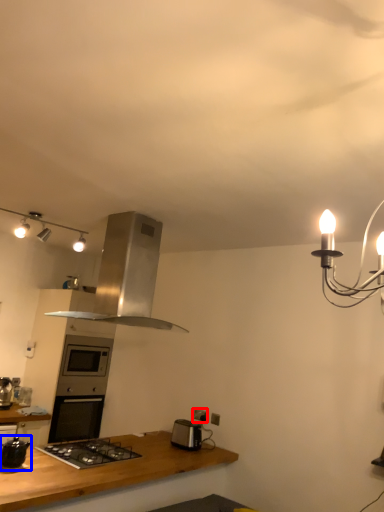
Question: Which object is closer to the camera taking this photo, electric outlet (highlighted by a red box) or kitchen appliance (highlighted by a blue box)?

Choices:
 (A) electric outlet
 (B) kitchen appliance

Answer: (B)